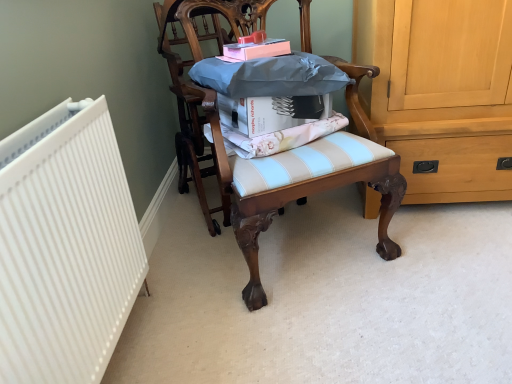
Question: Considering the positions of wooden chair at center, which is the 2th chair from left to right, and wooden chair at center, placed as the first chair when sorted from left to right, in the image, is wooden chair at center, which is the 2th chair from left to right, taller or shorter than wooden chair at center, placed as the first chair when sorted from left to right,?

Choices:
 (A) tall
 (B) short

Answer: (B)

Question: Based on their positions, is wooden chair at center, which is the 2th chair from left to right, located to the left or right of wooden chair at center, which ranks as the 2th chair in right-to-left order?

Choices:
 (A) left
 (B) right

Answer: (B)

Question: Estimate the real-world distances between objects in this image. Which object is farther from the pink matte book at upper center, marked as the 2th book in a bottom-to-top arrangement?

Choices:
 (A) wooden chair at center, arranged as the first chair when viewed from the right
 (B) light blue striped cushion at center
 (C) white matte book at center, positioned as the 1th book in bottom-to-top order
 (D) wooden chair at center, which ranks as the 2th chair in right-to-left order

Answer: (D)

Question: Estimate the real-world distances between objects in this image. Which object is closer to the white matte book at center, positioned as the 1th book in bottom-to-top order?

Choices:
 (A) pink matte book at upper center, the 1th book in the top-to-bottom sequence
 (B) light blue striped cushion at center
 (C) wooden chair at center, placed as the first chair when sorted from left to right
 (D) wooden chair at center, arranged as the first chair when viewed from the right

Answer: (B)